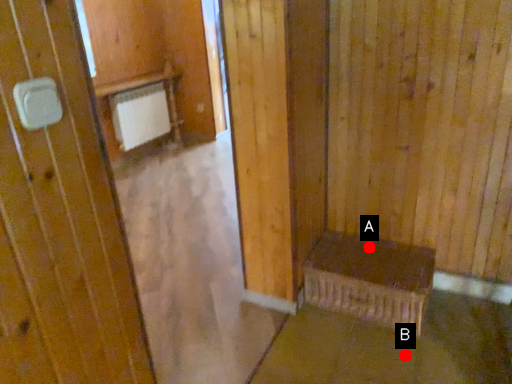
Question: Two points are circled on the image, labeled by A and B beside each circle. Which of the following is the closest to the observer?

Choices:
 (A) A is closer
 (B) B is closer

Answer: (B)